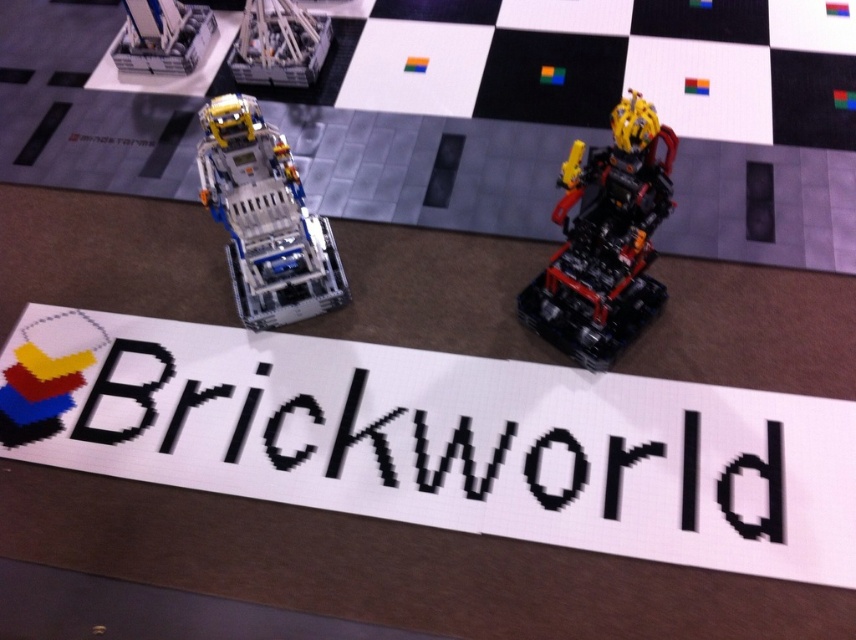
Question: Which object is closer to the camera taking this photo?

Choices:
 (A) metallic blue robot at center-left
 (B) translucent white plastic robot at upper left

Answer: (A)

Question: Is black plastic robot at center smaller than translucent white plastic robot at upper left?

Choices:
 (A) yes
 (B) no

Answer: (B)

Question: Which object is farther from the camera taking this photo?

Choices:
 (A) metallic blue robot at center-left
 (B) translucent plastic structure at upper center
 (C) translucent white plastic robot at upper left
 (D) black pixelated text at center

Answer: (C)

Question: Is black pixelated text at center behind metallic blue robot at center-left?

Choices:
 (A) yes
 (B) no

Answer: (B)

Question: Does metallic blue robot at center-left have a smaller size compared to translucent white plastic robot at upper left?

Choices:
 (A) yes
 (B) no

Answer: (B)

Question: Which point is closer to the camera taking this photo?

Choices:
 (A) (627, 515)
 (B) (305, 35)

Answer: (A)